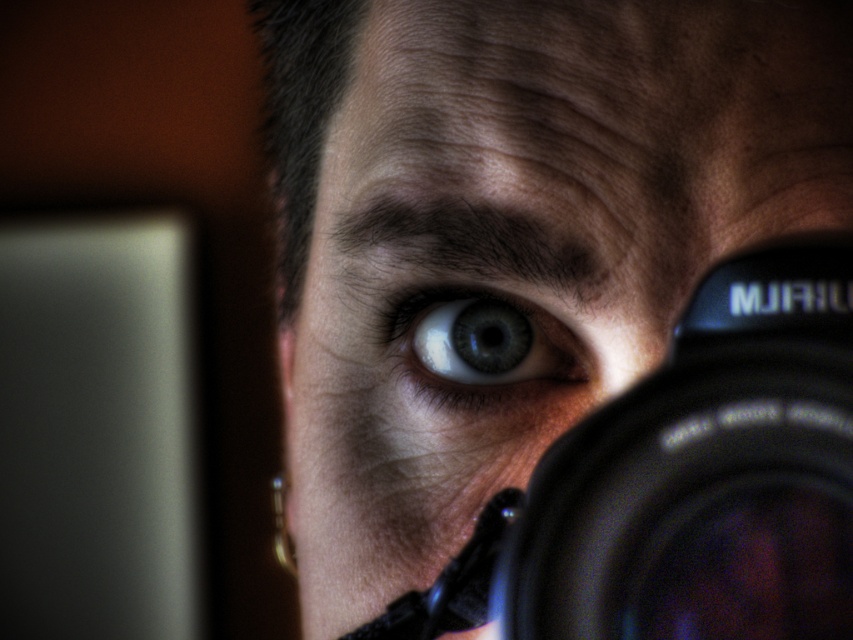
Question: Which of the following is the farthest from the observer?

Choices:
 (A) black plastic camera at center
 (B) matte black camera at center
 (C) blue glossy eye at center

Answer: (C)

Question: Which object appears farthest from the camera in this image?

Choices:
 (A) blue glossy eye at center
 (B) matte black camera at center

Answer: (A)

Question: Which of these objects is positioned farthest from the blue glossy eye at center?

Choices:
 (A) matte black camera at center
 (B) black plastic camera at center

Answer: (B)

Question: Can you confirm if matte black camera at center is positioned above black plastic camera at center?

Choices:
 (A) no
 (B) yes

Answer: (B)

Question: Does matte black camera at center appear on the right side of blue glossy eye at center?

Choices:
 (A) yes
 (B) no

Answer: (B)

Question: Is matte black camera at center wider than black plastic camera at center?

Choices:
 (A) yes
 (B) no

Answer: (A)